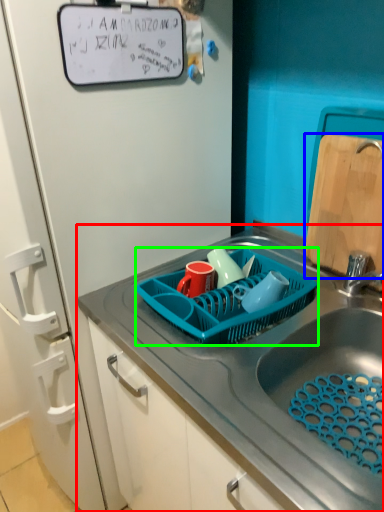
Question: Estimate the real-world distances between objects in this image. Which object is farther from sink (highlighted by a red box), cutting board (highlighted by a blue box) or basket (highlighted by a green box)?

Choices:
 (A) cutting board
 (B) basket

Answer: (A)